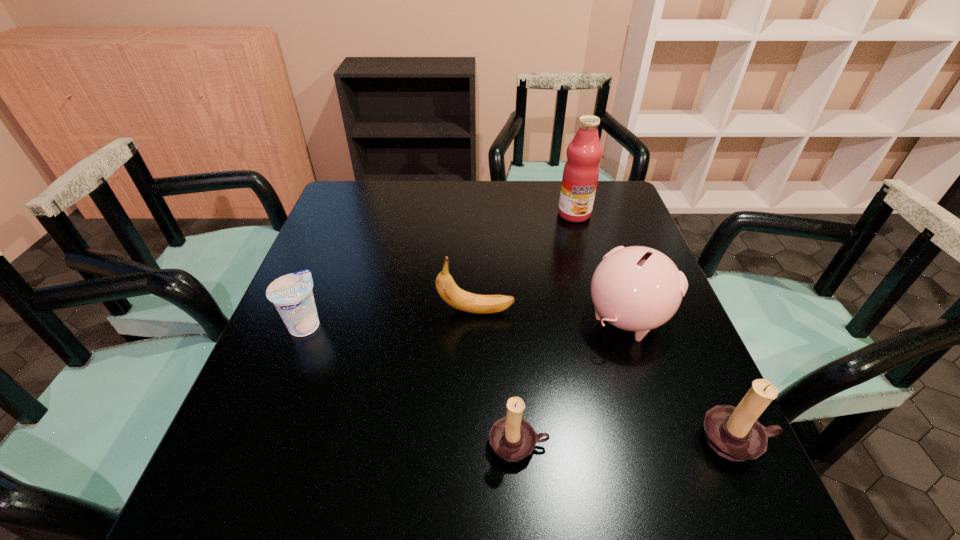
Where is `vacant region at the left edge of the desktop`? The height and width of the screenshot is (540, 960). vacant region at the left edge of the desktop is located at coordinates (322, 405).

Identify the location of vacant space at the right edge of the desktop. (621, 355).

This screenshot has width=960, height=540. In the image, there is a desktop. Identify the location of vacant space at the far left corner. (374, 184).

Image resolution: width=960 pixels, height=540 pixels. What are the coordinates of `free location at the far right corner of the desktop` in the screenshot? It's located at (630, 219).

Locate an element on the screen. free space between the banana and the shorter candle holder is located at coordinates (497, 377).

In order to click on free space between the piggy bank and the shortest object in this screenshot , I will do `click(466, 320)`.

Locate an element on the screen. The width and height of the screenshot is (960, 540). free point between the banana and the right candle holder is located at coordinates (607, 375).

Find the location of a particular element. vacant space that is in between the piggy bank and the yogurt is located at coordinates (466, 320).

Locate an element on the screen. This screenshot has height=540, width=960. free space between the shorter candle holder and the piggy bank is located at coordinates (572, 381).

Find the location of a particular element. This screenshot has width=960, height=540. free space between the right candle holder and the shorter candle holder is located at coordinates (628, 442).